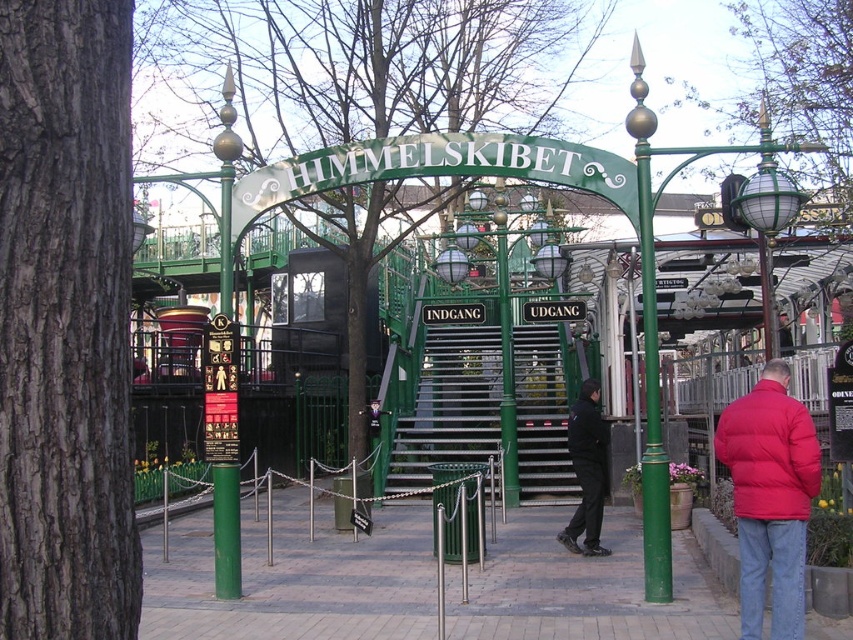
At what (x,y) coordinates should I click in order to perform the action: click on green metallic stairs at center. Please return your answer as a coordinate pair (x, y). Image resolution: width=853 pixels, height=640 pixels. Looking at the image, I should click on click(491, 410).

Is green metallic stairs at center bigger than dark blue jacket at center?

Indeed, green metallic stairs at center has a larger size compared to dark blue jacket at center.

What are the coordinates of `green metallic stairs at center` in the screenshot? It's located at pos(491,410).

Does point (224, 556) lie in front of point (595, 547)?

Yes, point (224, 556) is in front of point (595, 547).

Can you confirm if green polished metal pole at center-left is bigger than dark blue jacket at center?

Indeed, green polished metal pole at center-left has a larger size compared to dark blue jacket at center.

Identify the location of green polished metal pole at center-left. Image resolution: width=853 pixels, height=640 pixels. (225, 529).

Locate an element on the screen. The height and width of the screenshot is (640, 853). green polished metal pole at center-left is located at coordinates (225, 529).

Can you confirm if green metallic stairs at center is smaller than green polished metal pole at center-left?

Actually, green metallic stairs at center might be larger than green polished metal pole at center-left.

Does green metallic stairs at center have a greater width compared to green polished metal pole at center-left?

Yes, green metallic stairs at center is wider than green polished metal pole at center-left.

Is point (439, 330) behind point (212, 147)?

Yes, point (439, 330) is behind point (212, 147).

At what (x,y) coordinates should I click in order to perform the action: click on green metallic stairs at center. Please return your answer as a coordinate pair (x, y). Looking at the image, I should click on (491, 410).